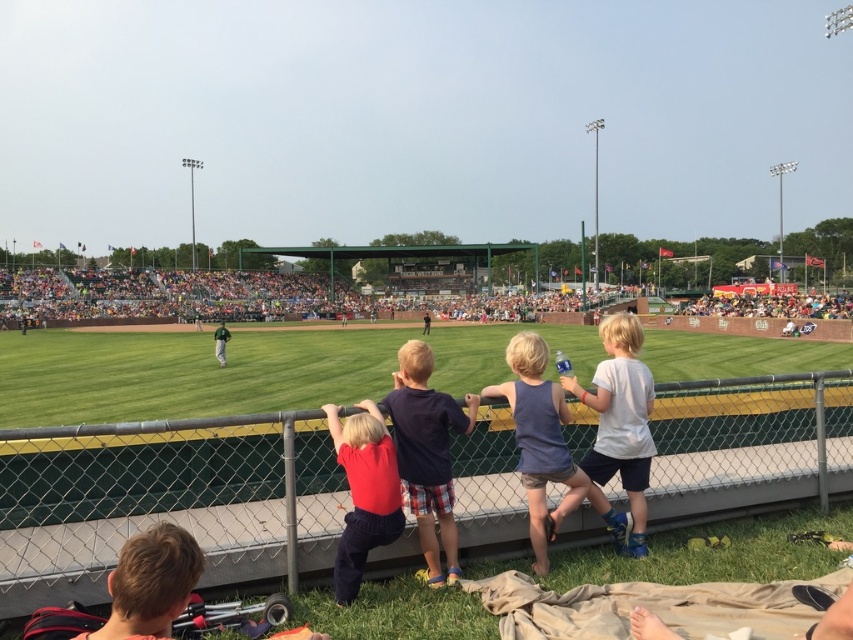
You are a photographer trying to capture a candid shot of both the blue cotton tank top at center and the blonde hair at lower left in the same frame. Given that your camera has a maximum focus range of 10 feet, will you be able to include both subjects in one photo without moving your position?

The distance between the blue cotton tank top at center and the blonde hair at lower left is 10.26 feet. Since your camera can only focus up to 10 feet, you won the t be able to capture both subjects in one photo without moving.

You are standing at the position marked by the point at coordinates (427, 452). What is the color of the shirt of the person you are standing on?

The point at coordinates (427, 452) marks the dark blue t shirt at center, so the color of the shirt is dark blue.